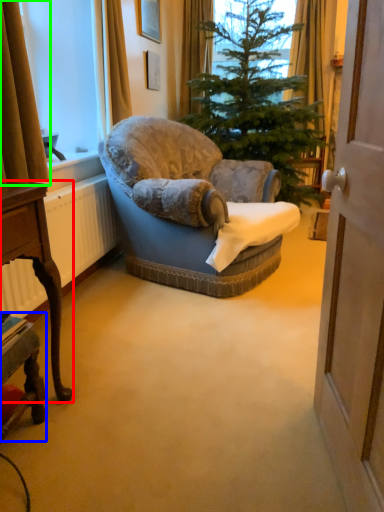
Question: Which is farther away from desk (highlighted by a red box)? desk (highlighted by a blue box) or curtain (highlighted by a green box)?

Choices:
 (A) desk
 (B) curtain

Answer: (B)